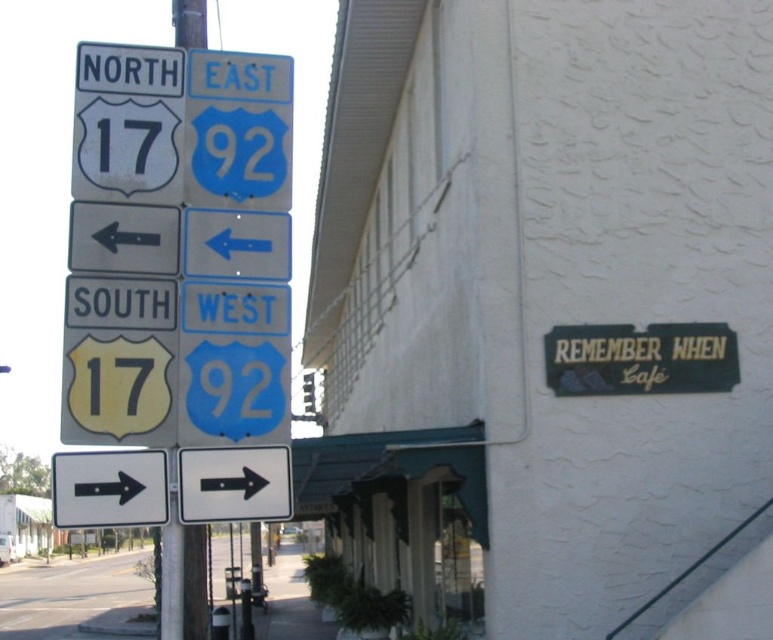
From the picture: You are a delivery driver who needs to attach a rectangular advertisement board to either the metallic pole at left or the yellow matte sign at left. Considering the width of the objects, which one can accommodate a wider advertisement board?

The metallic pole at left has a larger width than the yellow matte sign at left, so it can accommodate a wider advertisement board.

You are standing on the sidewalk and see the metallic pole at left. If you need to reach the pole within 10 feet, can you do it by taking 3 steps forward?

The metallic pole at left is 14.46 feet away from you. Since 3 steps are typically about 9 feet, you cannot reach it within 10 feet with just 3 steps.